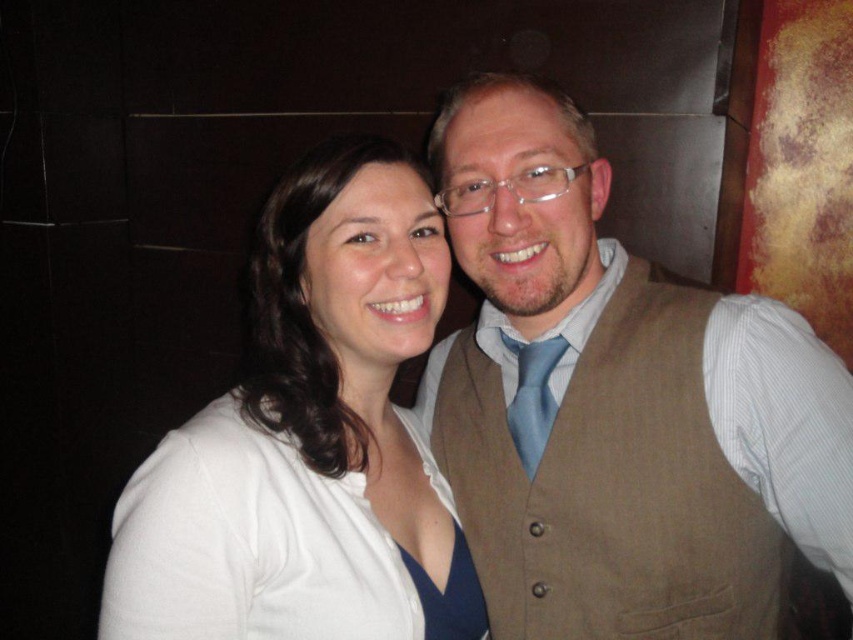
Can you confirm if brown suede vest at center is positioned above white fabric dress at center?

Correct, brown suede vest at center is located above white fabric dress at center.

Between point (589, 564) and point (236, 600), which one is positioned in front?

Positioned in front is point (236, 600).

The image size is (853, 640). I want to click on brown suede vest at center, so click(619, 403).

Is white matte shirt at center taller than white fabric dress at center?

Indeed, white matte shirt at center has a greater height compared to white fabric dress at center.

Does point (270, 301) come farther from viewer compared to point (274, 515)?

Yes, point (270, 301) is farther from viewer.

The height and width of the screenshot is (640, 853). What do you see at coordinates (308, 440) in the screenshot?
I see `white matte shirt at center` at bounding box center [308, 440].

The width and height of the screenshot is (853, 640). Identify the location of white matte shirt at center. (308, 440).

Who is more forward, (815, 548) or (438, 248)?

Point (815, 548) is in front.

Is brown suede vest at center above white matte shirt at center?

Yes.

Find the location of a particular element. The image size is (853, 640). brown suede vest at center is located at coordinates coord(619,403).